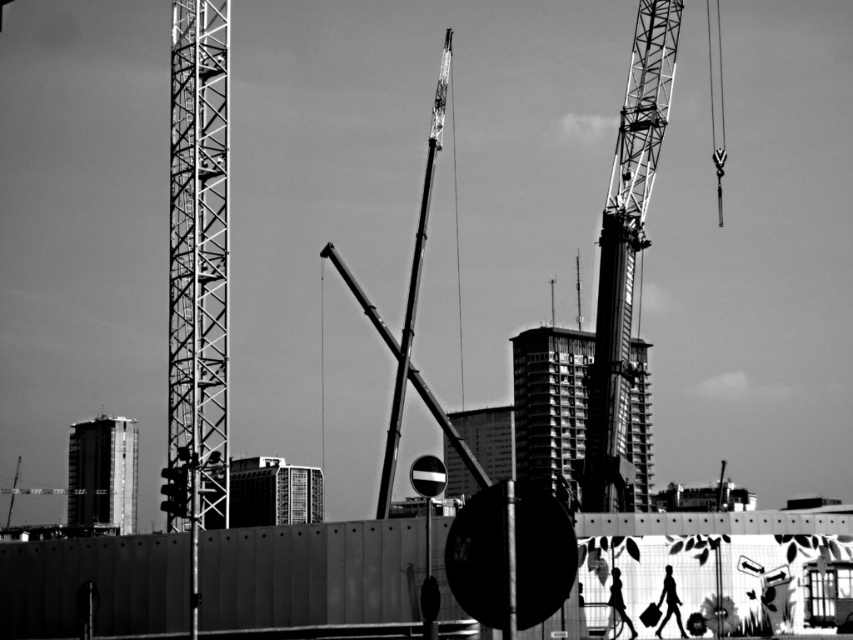
Who is higher up, smooth glass tower at lower left or smooth glass building at center?

Positioned higher is smooth glass building at center.

Describe the element at coordinates (102, 472) in the screenshot. I see `smooth glass tower at lower left` at that location.

Is point (90, 484) farther from camera compared to point (251, 472)?

That is False.

Find the location of a particular element. The height and width of the screenshot is (640, 853). smooth glass tower at lower left is located at coordinates (102, 472).

Does smooth concrete building at center appear under smooth glass tower at lower left?

Actually, smooth concrete building at center is above smooth glass tower at lower left.

From the picture: Is smooth concrete building at center to the left of smooth glass tower at lower left from the viewer's perspective?

No, smooth concrete building at center is not to the left of smooth glass tower at lower left.

This screenshot has width=853, height=640. I want to click on smooth concrete building at center, so click(x=550, y=404).

Who is more distant from viewer, (213, 244) or (595, 333)?

The point (595, 333) is behind.

What are the coordinates of `metallic lattice tower at left` in the screenshot? It's located at (199, 248).